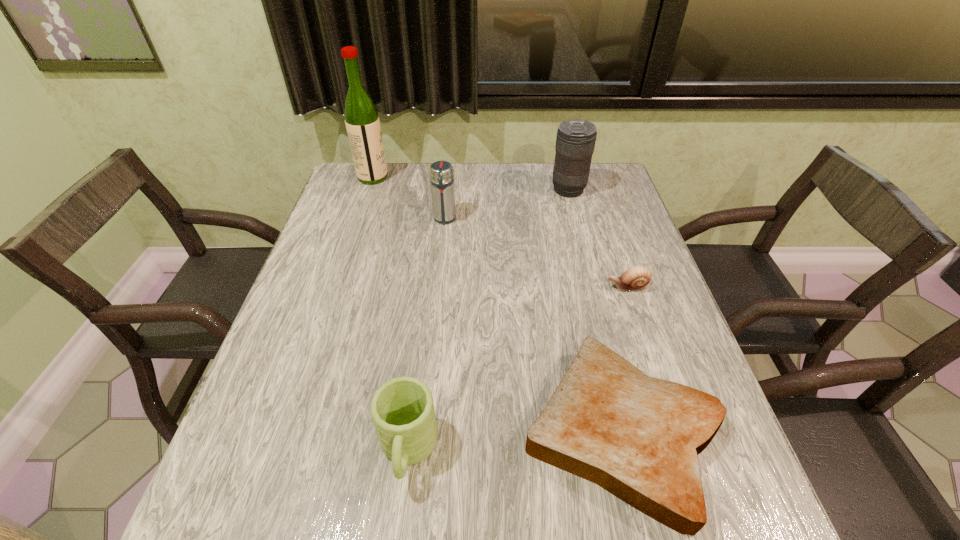
This screenshot has height=540, width=960. In order to click on the leftmost object in this screenshot , I will do click(362, 122).

This screenshot has height=540, width=960. In order to click on the tallest object in this screenshot , I will do 362,122.

Locate an element on the screen. This screenshot has height=540, width=960. the second tallest object is located at coordinates (575, 141).

This screenshot has height=540, width=960. Find the location of `thermos bottle`. thermos bottle is located at coordinates (441, 172).

The image size is (960, 540). What are the coordinates of `the fourth nearest object` in the screenshot? It's located at (441, 172).

Find the location of a particular element. the fourth tallest object is located at coordinates (402, 409).

The height and width of the screenshot is (540, 960). Identify the location of escargot. (636, 278).

What are the coordinates of `bread` in the screenshot? It's located at (638, 437).

Locate an element on the screen. This screenshot has height=540, width=960. free space located 0.400m on the label of the tallest object is located at coordinates (509, 178).

Image resolution: width=960 pixels, height=540 pixels. Identify the location of blank space located on the side of the telephoto lens where the control switches are located. click(503, 190).